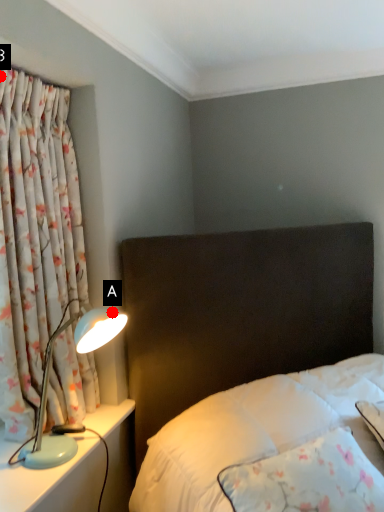
Question: Two points are circled on the image, labeled by A and B beside each circle. Which point appears farthest from the camera in this image?

Choices:
 (A) A is further
 (B) B is further

Answer: (A)